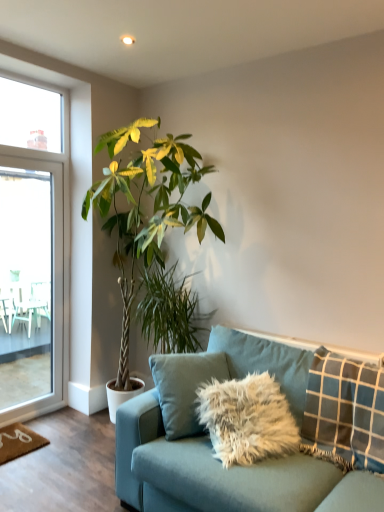
What are the coordinates of `transparent glass screen door at left` in the screenshot? It's located at (30, 284).

The height and width of the screenshot is (512, 384). Describe the element at coordinates (344, 412) in the screenshot. I see `blue checkered pillow at right` at that location.

In the scene shown: How much space does green leafy plant at center, marked as the first houseplant in a bottom-to-top arrangement, occupy horizontally?

18.85 inches.

Where is `teal fabric couch at lower right`? This screenshot has width=384, height=512. teal fabric couch at lower right is located at coordinates (264, 460).

Between green leafy plant at center, which is the 2th houseplant in top-to-bottom order, and transparent glass screen door at left, which one appears on the right side from the viewer's perspective?

Positioned to the right is green leafy plant at center, which is the 2th houseplant in top-to-bottom order.

Could you tell me if green leafy plant at center, marked as the first houseplant in a bottom-to-top arrangement, is facing transparent glass screen door at left?

No, green leafy plant at center, marked as the first houseplant in a bottom-to-top arrangement, is not aimed at transparent glass screen door at left.

From the image's perspective, is green leafy plant at center, which is the 2th houseplant in top-to-bottom order, above or below transparent glass screen door at left?

green leafy plant at center, which is the 2th houseplant in top-to-bottom order, is situated lower than transparent glass screen door at left in the image.

Is transparent glass screen door at left facing away from green leafy plant at center, which is the 2th houseplant in top-to-bottom order?

No, transparent glass screen door at left is not facing the opposite direction of green leafy plant at center, which is the 2th houseplant in top-to-bottom order.

Consider the image. From the image's perspective, is transparent glass screen door at left on green leafy plant at center, marked as the first houseplant in a bottom-to-top arrangement?

Yes, from the image's perspective, transparent glass screen door at left is on top of green leafy plant at center, marked as the first houseplant in a bottom-to-top arrangement.

Visually, is transparent glass screen door at left positioned to the left or to the right of green leafy plant at center, which is the 2th houseplant in top-to-bottom order?

From the image, it's evident that transparent glass screen door at left is to the left of green leafy plant at center, which is the 2th houseplant in top-to-bottom order.

From a real-world perspective, which object rests below the other?

From a 3D spatial view, green leafy plant at center, marked as the first houseplant in a bottom-to-top arrangement, is below.

Measure the distance between teal fabric couch at lower right and green leafy plant at center, which is counted as the first houseplant, starting from the top.

1.07 meters.

Is teal fabric couch at lower right looking in the opposite direction of green leafy plant at center, which is counted as the first houseplant, starting from the top?

No.

Is teal fabric couch at lower right outside of green leafy plant at center, which is counted as the first houseplant, starting from the top?

teal fabric couch at lower right lies outside green leafy plant at center, which is counted as the first houseplant, starting from the top,'s area.

From a real-world perspective, which is physically below, teal fabric couch at lower right or green leafy plant at center, which is counted as the first houseplant, starting from the top?

From a 3D spatial view, teal fabric couch at lower right is below.

Is green leafy plant at center, the 2th houseplant in the bottom-to-top sequence, far away from blue checkered pillow at right?

That's right, there is a large distance between green leafy plant at center, the 2th houseplant in the bottom-to-top sequence, and blue checkered pillow at right.

Can we say green leafy plant at center, which is counted as the first houseplant, starting from the top, lies outside blue checkered pillow at right?

Absolutely, green leafy plant at center, which is counted as the first houseplant, starting from the top, is external to blue checkered pillow at right.

Can you confirm if green leafy plant at center, the 2th houseplant in the bottom-to-top sequence, is bigger than blue checkered pillow at right?

Yes.

Based on the photo, which object is wider, green leafy plant at center, the 2th houseplant in the bottom-to-top sequence, or blue checkered pillow at right?

Wider between the two is green leafy plant at center, the 2th houseplant in the bottom-to-top sequence.

From a real-world perspective, is blue checkered pillow at right on green leafy plant at center, the 2th houseplant in the bottom-to-top sequence?

No, from a real-world perspective, blue checkered pillow at right is not over green leafy plant at center, the 2th houseplant in the bottom-to-top sequence

Looking at this image, is the surface of blue checkered pillow at right in direct contact with green leafy plant at center, which is counted as the first houseplant, starting from the top?

No, blue checkered pillow at right is not touching green leafy plant at center, which is counted as the first houseplant, starting from the top.

Which of these two, blue checkered pillow at right or green leafy plant at center, the 2th houseplant in the bottom-to-top sequence, is smaller?

blue checkered pillow at right.

How different are the orientations of blue checkered pillow at right and green leafy plant at center, which is counted as the first houseplant, starting from the top, in degrees?

The angle between the facing direction of blue checkered pillow at right and the facing direction of green leafy plant at center, which is counted as the first houseplant, starting from the top, is 1.18 degrees.

Considering the relative sizes of transparent glass screen door at left and blue checkered pillow at right in the image provided, is transparent glass screen door at left wider than blue checkered pillow at right?

Incorrect, the width of transparent glass screen door at left does not surpass that of blue checkered pillow at right.

From the image's perspective, is transparent glass screen door at left on top of blue checkered pillow at right?

Yes, from the image's perspective, transparent glass screen door at left is over blue checkered pillow at right.

How different are the orientations of transparent glass screen door at left and blue checkered pillow at right in degrees?

90.9 degrees separate the facing orientations of transparent glass screen door at left and blue checkered pillow at right.

Would you say transparent glass screen door at left is inside or outside blue checkered pillow at right?

transparent glass screen door at left is not inside blue checkered pillow at right, it's outside.

Between green leafy plant at center, which is counted as the first houseplant, starting from the top, and green leafy plant at center, marked as the first houseplant in a bottom-to-top arrangement, which one is positioned in front?

green leafy plant at center, which is counted as the first houseplant, starting from the top, is closer to the camera.

Is green leafy plant at center, the 2th houseplant in the bottom-to-top sequence, placed right next to green leafy plant at center, which is the 2th houseplant in top-to-bottom order?

No, green leafy plant at center, the 2th houseplant in the bottom-to-top sequence, is not next to green leafy plant at center, which is the 2th houseplant in top-to-bottom order.

I want to click on screen door behind the green leafy plant at center, marked as the first houseplant in a bottom-to-top arrangement, so click(x=30, y=284).

Image resolution: width=384 pixels, height=512 pixels. I want to click on houseplant below the transparent glass screen door at left (from the image's perspective), so click(x=170, y=311).

Considering their positions, is teal fabric couch at lower right positioned further to blue checkered pillow at right than green leafy plant at center, which is the 2th houseplant in top-to-bottom order?

green leafy plant at center, which is the 2th houseplant in top-to-bottom order, is further to blue checkered pillow at right.

Looking at the image, which one is located further to teal fabric couch at lower right, blue checkered pillow at right or green leafy plant at center, marked as the first houseplant in a bottom-to-top arrangement?

The object further to teal fabric couch at lower right is green leafy plant at center, marked as the first houseplant in a bottom-to-top arrangement.

Estimate the real-world distances between objects in this image. Which object is closer to green leafy plant at center, which is the 2th houseplant in top-to-bottom order, transparent glass screen door at left or blue checkered pillow at right?

Based on the image, transparent glass screen door at left appears to be nearer to green leafy plant at center, which is the 2th houseplant in top-to-bottom order.

From the image, which object appears to be nearer to transparent glass screen door at left, teal fabric couch at lower right or green leafy plant at center, the 2th houseplant in the bottom-to-top sequence?

Based on the image, green leafy plant at center, the 2th houseplant in the bottom-to-top sequence, appears to be nearer to transparent glass screen door at left.

When comparing their distances from blue checkered pillow at right, does green leafy plant at center, which is the 2th houseplant in top-to-bottom order, or transparent glass screen door at left seem further?

transparent glass screen door at left is further to blue checkered pillow at right.

Considering their positions, is green leafy plant at center, marked as the first houseplant in a bottom-to-top arrangement, positioned closer to teal fabric couch at lower right than blue checkered pillow at right?

Based on the image, blue checkered pillow at right appears to be nearer to teal fabric couch at lower right.

Which object lies nearer to the anchor point green leafy plant at center, marked as the first houseplant in a bottom-to-top arrangement, blue checkered pillow at right or transparent glass screen door at left?

transparent glass screen door at left is positioned closer to the anchor green leafy plant at center, marked as the first houseplant in a bottom-to-top arrangement.

From the picture: Which object lies nearer to the anchor point green leafy plant at center, marked as the first houseplant in a bottom-to-top arrangement, teal fabric couch at lower right or transparent glass screen door at left?

Based on the image, teal fabric couch at lower right appears to be nearer to green leafy plant at center, marked as the first houseplant in a bottom-to-top arrangement.

The image size is (384, 512). What are the coordinates of `studio couch situated between transparent glass screen door at left and blue checkered pillow at right from left to right` in the screenshot? It's located at (264, 460).

Image resolution: width=384 pixels, height=512 pixels. I want to click on houseplant located between green leafy plant at center, the 2th houseplant in the bottom-to-top sequence, and blue checkered pillow at right in the left-right direction, so click(x=170, y=311).

Identify the location of houseplant positioned between teal fabric couch at lower right and green leafy plant at center, which is the 2th houseplant in top-to-bottom order, from near to far. The height and width of the screenshot is (512, 384). (143, 212).

The height and width of the screenshot is (512, 384). What are the coordinates of `studio couch between green leafy plant at center, the 2th houseplant in the bottom-to-top sequence, and blue checkered pillow at right, in the horizontal direction` in the screenshot? It's located at (264, 460).